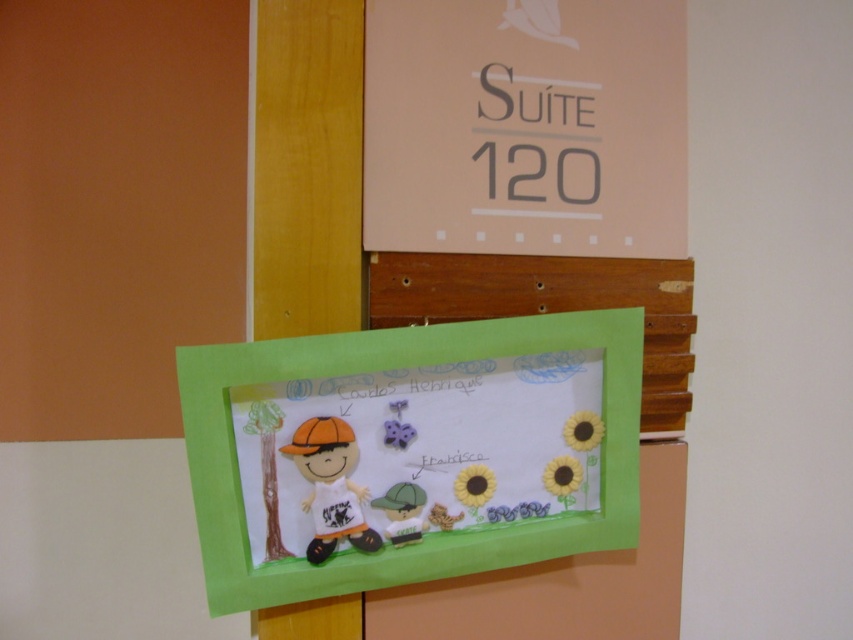
Question: Which of the following is the farthest from the observer?

Choices:
 (A) (427, 372)
 (B) (669, 332)

Answer: (B)

Question: Which object appears closest to the camera in this image?

Choices:
 (A) green paperboard at center
 (B) matte green paperboard at center

Answer: (B)

Question: Does matte green paperboard at center appear over green paperboard at center?

Choices:
 (A) yes
 (B) no

Answer: (B)

Question: Does matte green paperboard at center appear on the right side of green paperboard at center?

Choices:
 (A) no
 (B) yes

Answer: (A)

Question: Can you confirm if matte green paperboard at center is positioned to the right of green paperboard at center?

Choices:
 (A) yes
 (B) no

Answer: (B)